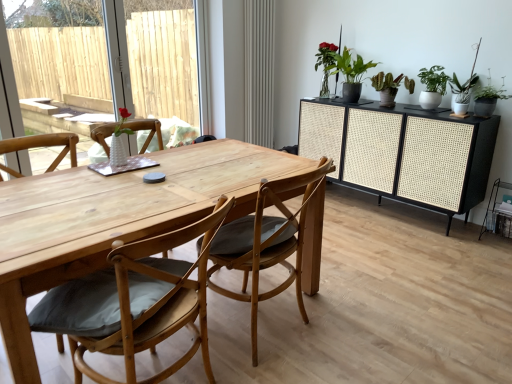
I want to click on free spot to the right of natural wood table at center, so click(389, 296).